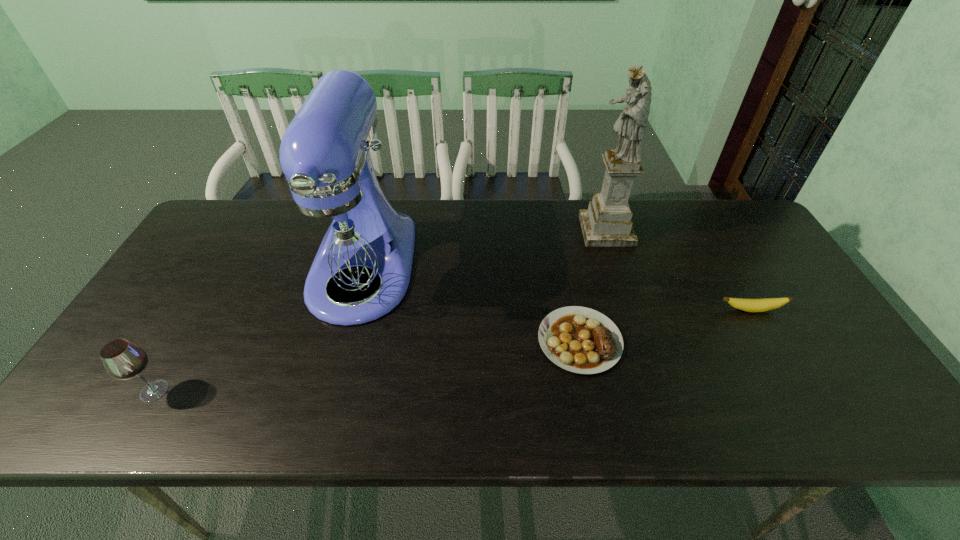
Identify the location of vacant area at the far edge of the desktop. Image resolution: width=960 pixels, height=540 pixels. (460, 218).

You are a GUI agent. You are given a task and a screenshot of the screen. Output one action in this format:
    pyautogui.click(x=<x>, y=<y>)
    Task: Click on the vacant space at the near edge of the desktop
    
    Given the screenshot: What is the action you would take?
    pyautogui.click(x=166, y=399)

At what (x,y) coordinates should I click in order to perform the action: click on vacant space at the left edge of the desktop. Please return your answer as a coordinate pair (x, y). The width and height of the screenshot is (960, 540). Looking at the image, I should click on (212, 271).

This screenshot has height=540, width=960. I want to click on unoccupied position between the second object from left to right and the leftmost object, so click(x=258, y=329).

Identify the location of empty space between the steak and the leftmost object. This screenshot has width=960, height=540. (367, 366).

This screenshot has height=540, width=960. Identify the location of free space between the sculpture and the mixer. (484, 249).

Image resolution: width=960 pixels, height=540 pixels. I want to click on unoccupied area between the rightmost object and the mixer, so click(x=557, y=289).

This screenshot has height=540, width=960. I want to click on free spot between the sculpture and the mixer, so click(x=484, y=249).

I want to click on free space between the third tallest object and the steak, so click(x=367, y=366).

At what (x,y) coordinates should I click in order to perform the action: click on unoccupied area between the steak and the sculpture. Please return your answer as a coordinate pair (x, y). The width and height of the screenshot is (960, 540). Looking at the image, I should click on (593, 286).